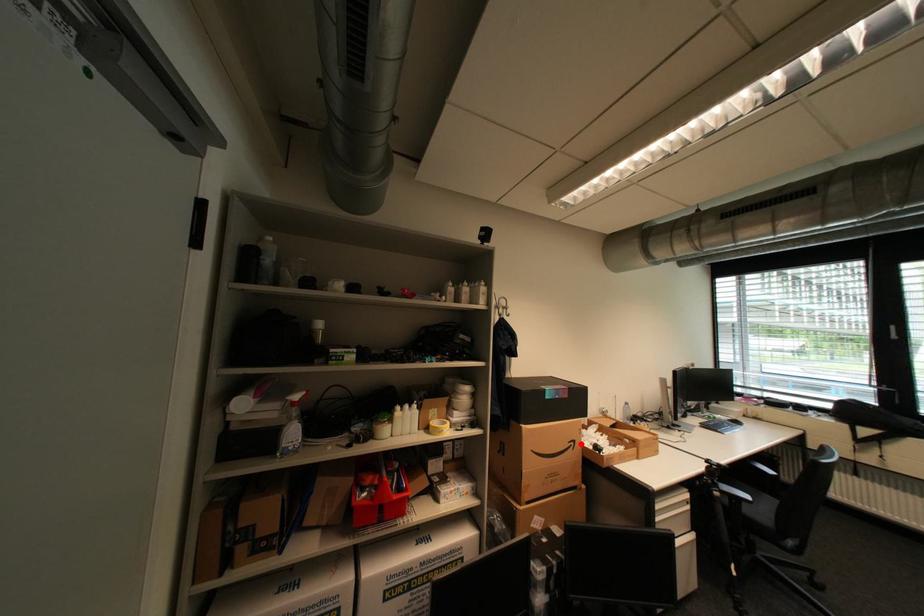
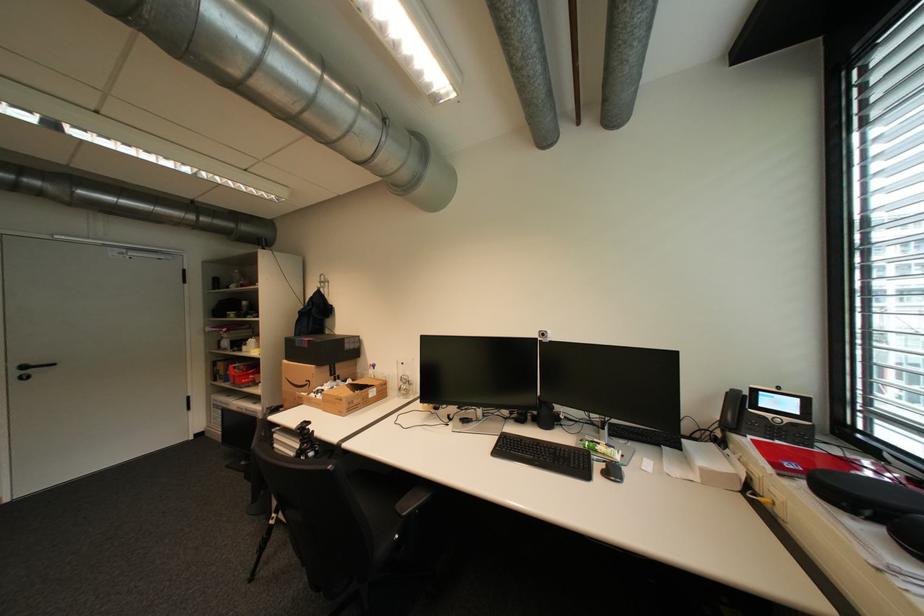
Locate, in the second image, the point that corresponds to the highlighted location in the first image.

(317, 383)